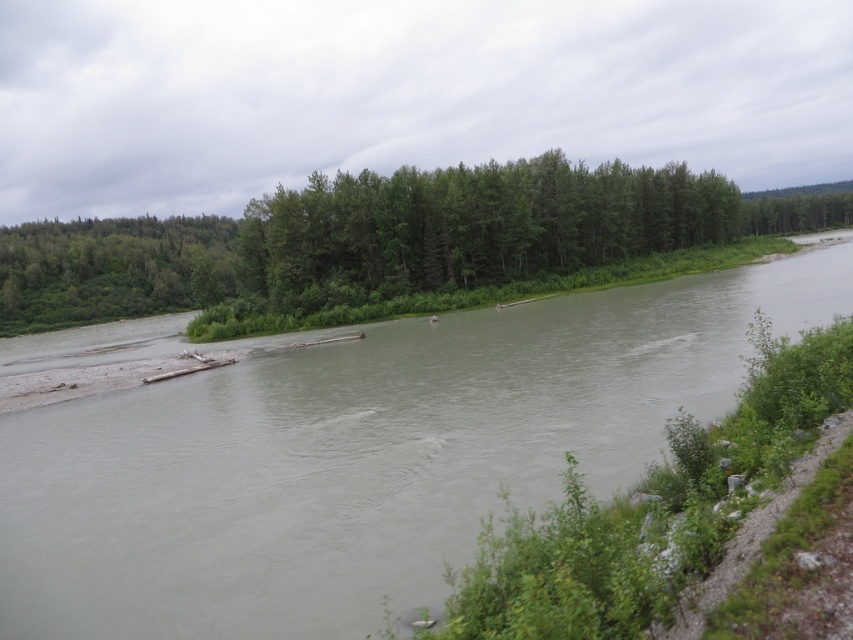
Question: Among these objects, which one is farthest from the camera?

Choices:
 (A) green matte forest at center
 (B) brown muddy water at center

Answer: (A)

Question: Can you confirm if brown muddy water at center is positioned below green matte forest at center?

Choices:
 (A) no
 (B) yes

Answer: (B)

Question: Is brown muddy water at center smaller than green matte forest at center?

Choices:
 (A) no
 (B) yes

Answer: (B)

Question: Does brown muddy water at center lie behind green matte forest at center?

Choices:
 (A) yes
 (B) no

Answer: (B)